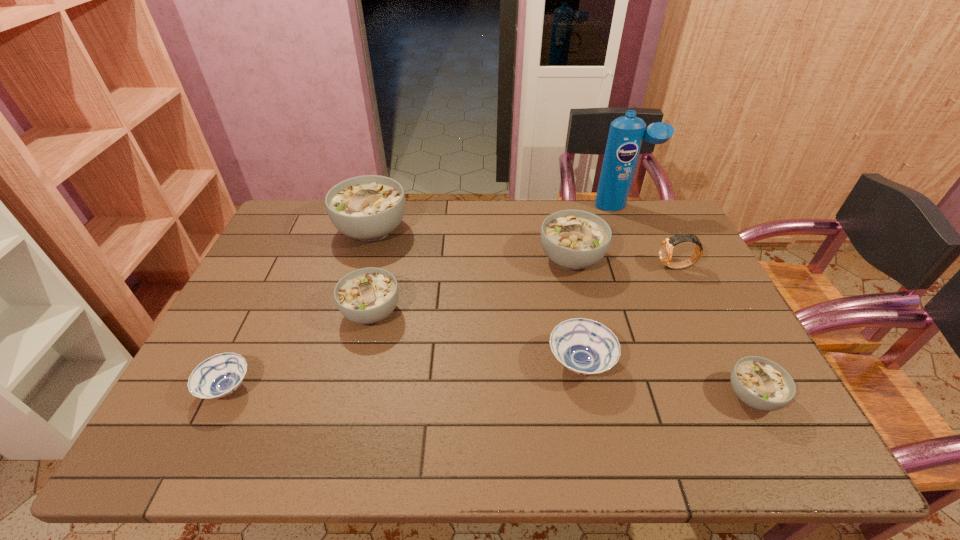
You are a GUI agent. You are given a task and a screenshot of the screen. Output one action in this format:
    pyautogui.click(x=<x>, y=<y>)
    Task: Click on the free space at the near edge of the desktop
    This screenshot has width=960, height=540.
    Given the screenshot: What is the action you would take?
    pyautogui.click(x=644, y=444)

Identify the location of free region at the left edge of the desktop. (248, 394).

Locate an element on the screen. This screenshot has width=960, height=540. vacant space at the right edge is located at coordinates [x=652, y=255].

Where is `free space at the far left corner of the desktop`? The width and height of the screenshot is (960, 540). free space at the far left corner of the desktop is located at coordinates (310, 225).

In the image, there is a desktop. Identify the location of vacant space at the far right corner. 670,205.

Find the location of a particular element. free space at the near right corner of the desktop is located at coordinates [x=801, y=440].

Image resolution: width=960 pixels, height=540 pixels. I want to click on free point between the right blue soup bowl and the nearest white soup bowl, so click(x=666, y=380).

Find the location of a particular element. The image size is (960, 540). free space between the bigger blue soup bowl and the nearest white soup bowl is located at coordinates (666, 380).

The height and width of the screenshot is (540, 960). Identify the location of free area in between the rightmost soup bowl and the tallest soup bowl. (562, 313).

Image resolution: width=960 pixels, height=540 pixels. Find the location of `unoccupied position between the tallest soup bowl and the shampoo`. unoccupied position between the tallest soup bowl and the shampoo is located at coordinates (497, 218).